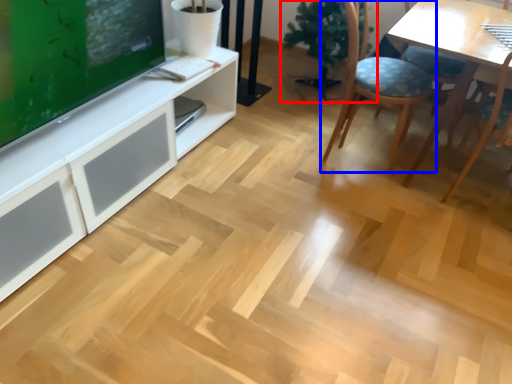
Question: Which object is further to the camera taking this photo, houseplant (highlighted by a red box) or chair (highlighted by a blue box)?

Choices:
 (A) houseplant
 (B) chair

Answer: (A)